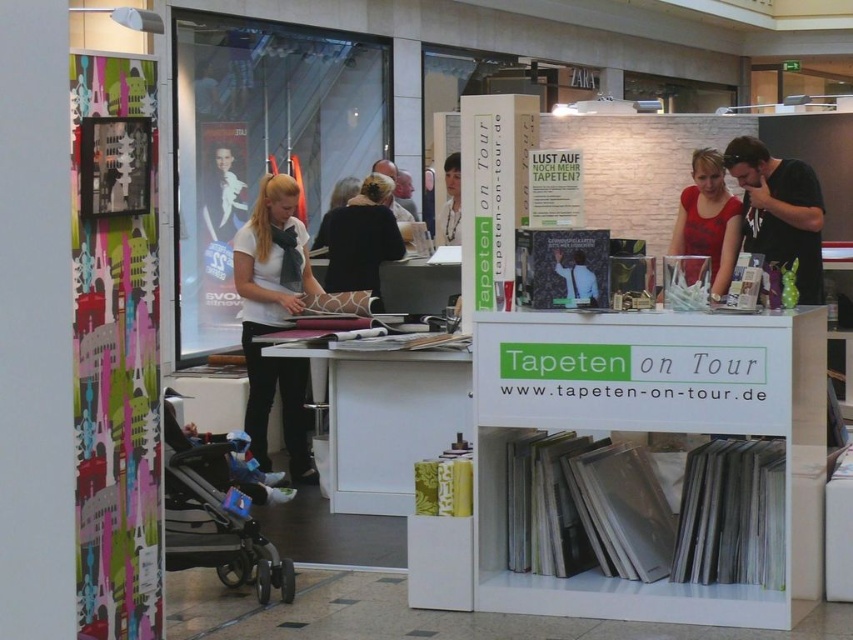
You are a customer at the mall and see the booth with the white matte shirt at center and the matte red blouse at center. Which clothing item is taller?

The white matte shirt at center is taller than the matte red blouse at center.